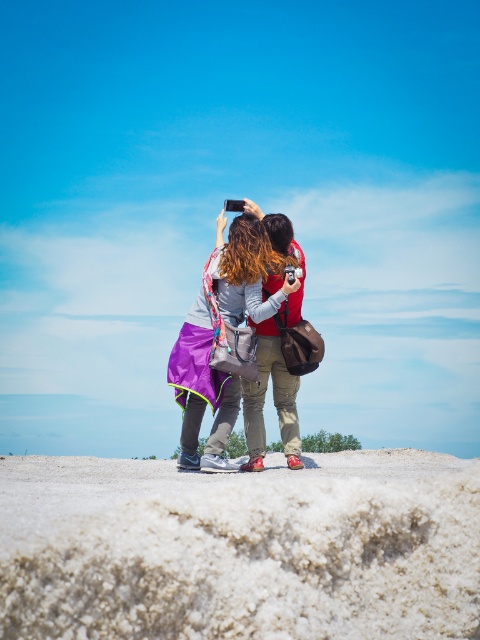
You are a photographer trying to capture a photo of the purple fabric jacket at center and the matte red shoes at center. Since you want to ensure both are in focus, you need to know which object is taller. Can you tell me which one is taller?

The purple fabric jacket at center is taller than the matte red shoes at center.

You are standing at the point marked by the coordinates point (202, 390) in the image. What object is located at that point?

The point (202, 390) indicates the purple fabric jacket at center.

You are a photographer trying to capture the purple fabric jacket at center in your shot. The camera you are using has a sensor that can only focus on objects within a 0.5 unit radius centered at point 0.5, 0.5. Will the jacket be in focus?

The purple fabric jacket at center is located at point (202, 390). The distance from this point to the center (240, 320) is sqrt of squared differences in x and y coordinates. Calculating sqrt of squared difference in x is 0.111 squared which is 0.0123, squared difference in y is 0.421 minus 0.5 is negative 0.079 squared is 0.00624. Adding them gives 0.0185. Square root of that is approximately 0.136 units. Since 0.136 is less than 0.5, the jacket will be within the focus area.